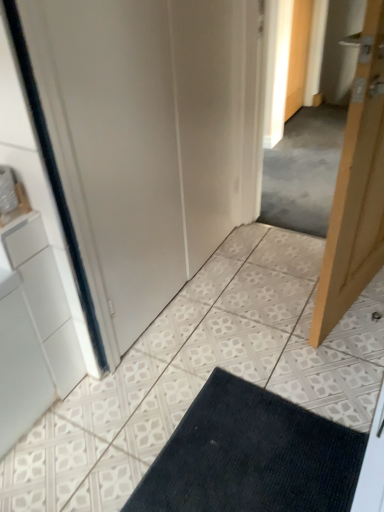
Question: Is wooden door at upper right, which is the 2th door in bottom-to-top order, at the left side of dark blue textured bath mat at lower center?

Choices:
 (A) no
 (B) yes

Answer: (A)

Question: Can you confirm if wooden door at upper right, the 1th door positioned from the top, is bigger than dark blue textured bath mat at lower center?

Choices:
 (A) no
 (B) yes

Answer: (B)

Question: Could you tell me if wooden door at upper right, the 1th door positioned from the top, is facing dark blue textured bath mat at lower center?

Choices:
 (A) no
 (B) yes

Answer: (A)

Question: Is wooden door at upper right, the 1th door positioned from the top, beside dark blue textured bath mat at lower center?

Choices:
 (A) no
 (B) yes

Answer: (A)

Question: Does wooden door at upper right, the 1th door positioned from the top, have a lesser width compared to dark blue textured bath mat at lower center?

Choices:
 (A) no
 (B) yes

Answer: (B)

Question: From the image's perspective, relative to wooden door at upper right, the 1th door from the back, is dark blue textured bath mat at lower center above or below?

Choices:
 (A) above
 (B) below

Answer: (B)

Question: In terms of width, does dark blue textured bath mat at lower center look wider or thinner when compared to wooden door at upper right, the 1th door positioned from the top?

Choices:
 (A) thin
 (B) wide

Answer: (B)

Question: Considering the positions of dark blue textured bath mat at lower center and wooden door at upper right, the 1th door positioned from the top, in the image, is dark blue textured bath mat at lower center taller or shorter than wooden door at upper right, the 1th door positioned from the top,?

Choices:
 (A) short
 (B) tall

Answer: (A)

Question: Considering the relative positions of dark blue textured bath mat at lower center and wooden door at upper right, the 1th door from the back, in the image provided, is dark blue textured bath mat at lower center to the left or to the right of wooden door at upper right, the 1th door from the back,?

Choices:
 (A) left
 (B) right

Answer: (A)

Question: Is dark blue textured bath mat at lower center wider or thinner than light wood door at right, placed as the 2th door when sorted from back to front?

Choices:
 (A) thin
 (B) wide

Answer: (B)

Question: In terms of size, does dark blue textured bath mat at lower center appear bigger or smaller than light wood door at right, placed as the 2th door when sorted from back to front?

Choices:
 (A) small
 (B) big

Answer: (A)

Question: Considering the positions of dark blue textured bath mat at lower center and light wood door at right, acting as the first door starting from the front, in the image, is dark blue textured bath mat at lower center taller or shorter than light wood door at right, acting as the first door starting from the front,?

Choices:
 (A) short
 (B) tall

Answer: (A)

Question: Is dark blue textured bath mat at lower center in front of or behind light wood door at right, marked as the first door in a bottom-to-top arrangement, in the image?

Choices:
 (A) front
 (B) behind

Answer: (B)

Question: Looking at their shapes, would you say white matte door at center is wider or thinner than wooden door at upper right, the 1th door from the back?

Choices:
 (A) thin
 (B) wide

Answer: (B)

Question: Do you think white matte door at center is within wooden door at upper right, the 1th door positioned from the top, or outside of it?

Choices:
 (A) outside
 (B) inside

Answer: (A)